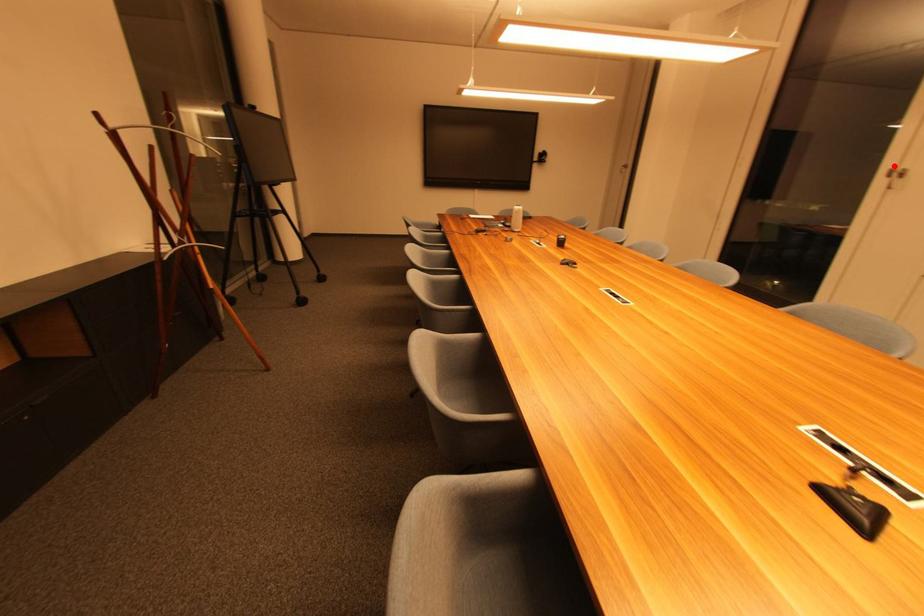
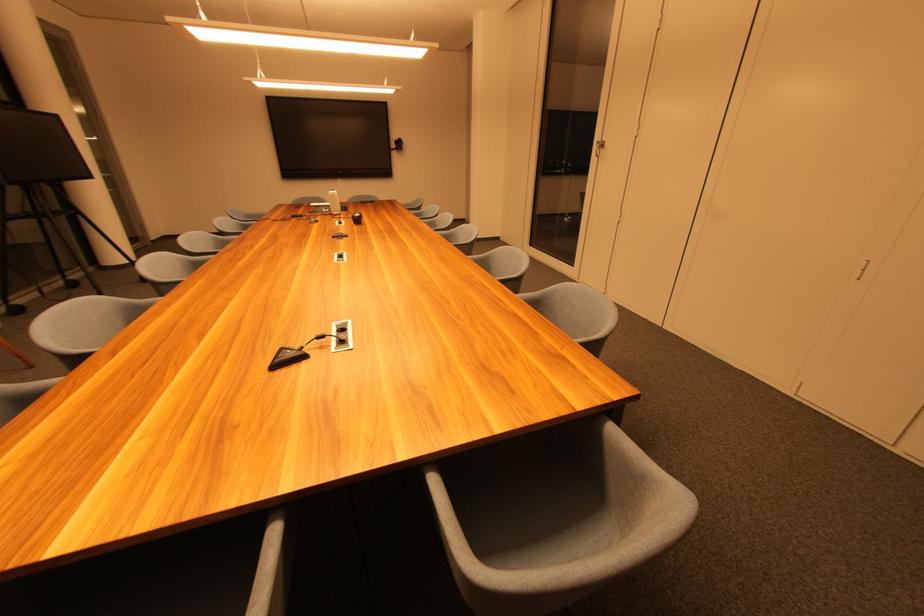
Find the pixel in the second image that matches the highlighted location in the first image.

(602, 140)